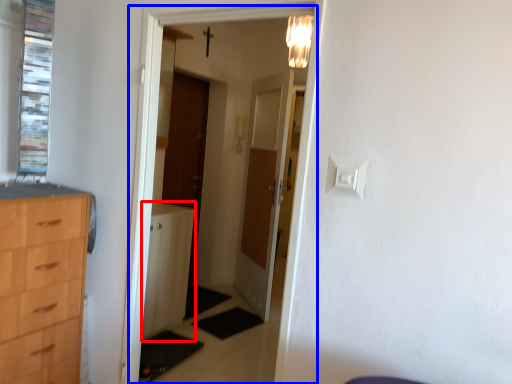
Question: Which object appears closest to the camera in this image, file cabinet (highlighted by a red box) or corridor (highlighted by a blue box)?

Choices:
 (A) file cabinet
 (B) corridor

Answer: (B)